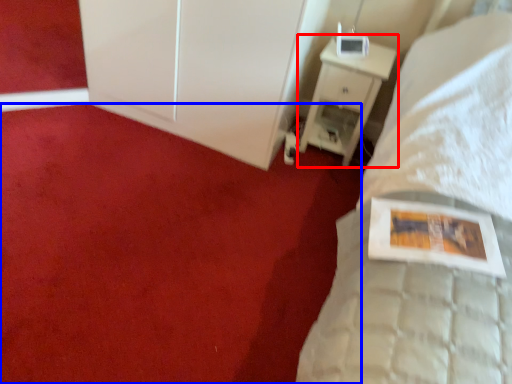
Question: Which point is closer to the camera, nightstand (highlighted by a red box) or plain (highlighted by a blue box)?

Choices:
 (A) nightstand
 (B) plain

Answer: (B)